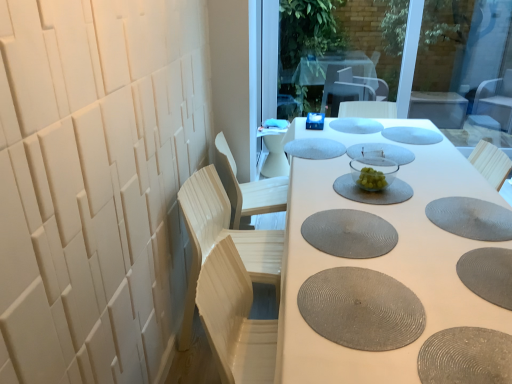
The width and height of the screenshot is (512, 384). In order to click on free area in between gray textured placemat at lower right, the 6th manhole cover in the back-to-front sequence, and clear glass bowl at center in this screenshot , I will do `click(407, 199)`.